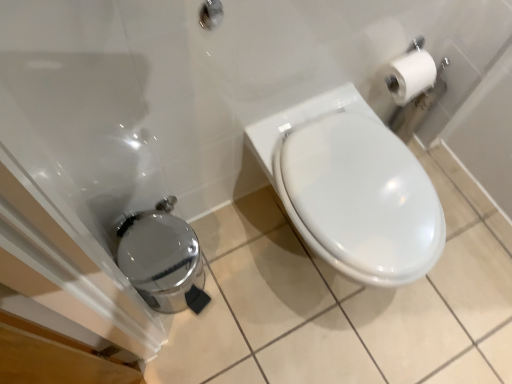
At what (x,y) coordinates should I click in order to perform the action: click on vacant space situated above white glossy toilet at center (from a real-world perspective). Please return your answer as a coordinate pair (x, y). This screenshot has height=384, width=512. Looking at the image, I should click on (366, 187).